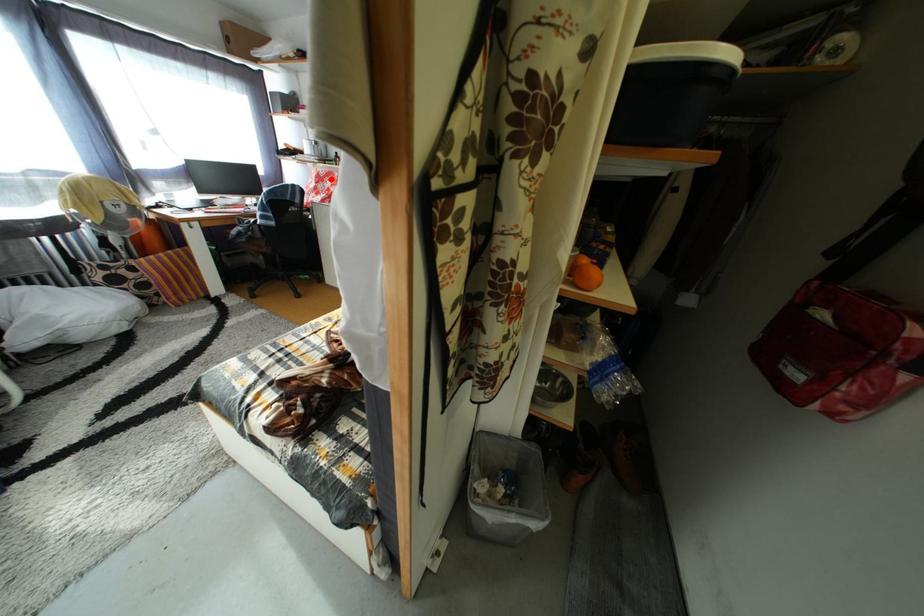
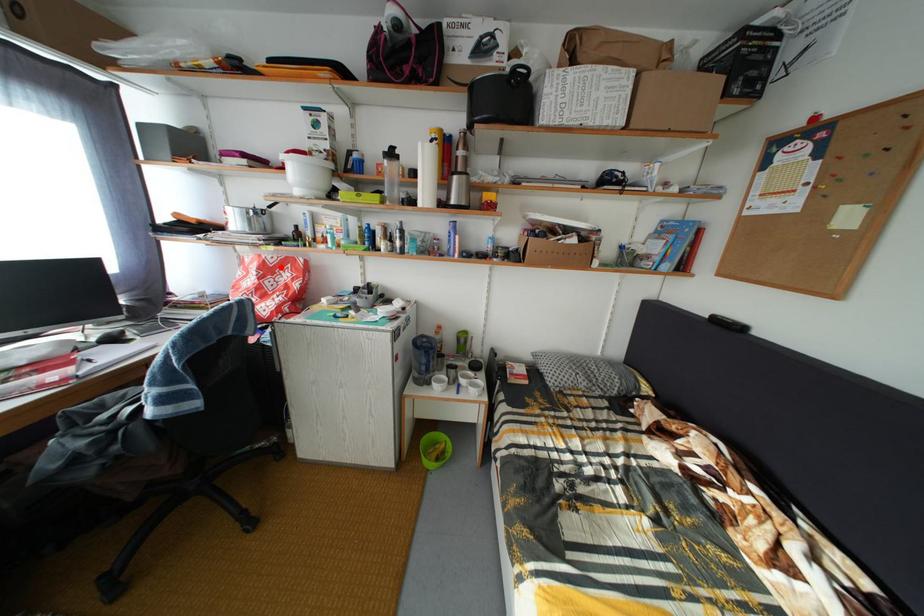
I am providing you with two images of the same scene from different viewpoints. A red point is marked on the first image and another point is marked on the second image. Is the marked point in image1 the same physical position as the marked point in image2?

Yes